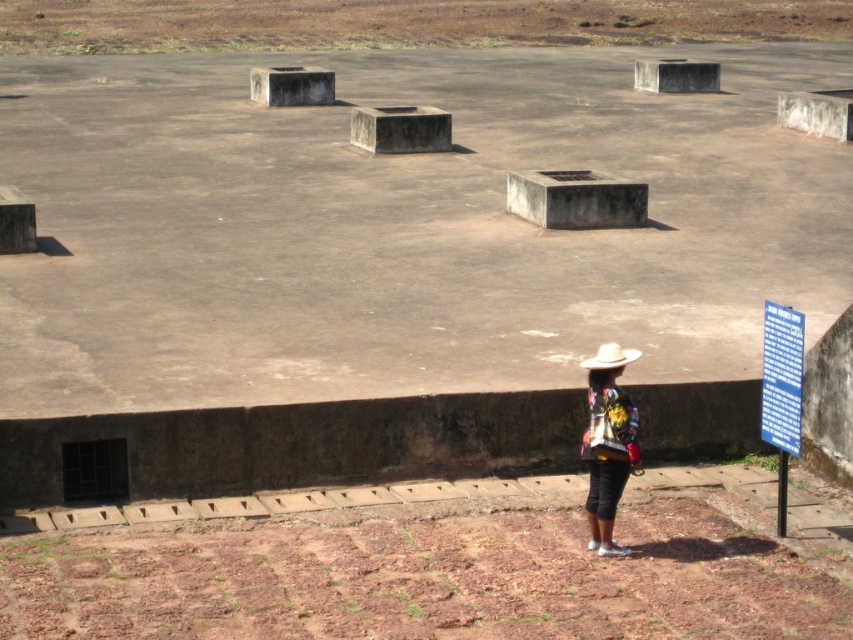
Does floral fabric jacket at lower right have a smaller size compared to white matte cowboy hat at lower right?

Yes.

Is floral fabric jacket at lower right below white matte cowboy hat at lower right?

Correct, floral fabric jacket at lower right is located below white matte cowboy hat at lower right.

Describe the element at coordinates (607, 444) in the screenshot. I see `floral fabric jacket at lower right` at that location.

Locate an element on the screen. The height and width of the screenshot is (640, 853). floral fabric jacket at lower right is located at coordinates (607, 444).

Is brown dirt field at upper center further to the viewer compared to floral fabric jacket at lower right?

Yes, it is.

Identify the location of brown dirt field at upper center. (403, 22).

Is brown dirt field at upper center shorter than white matte cowboy hat at lower right?

In fact, brown dirt field at upper center may be taller than white matte cowboy hat at lower right.

Who is taller, brown dirt field at upper center or white matte cowboy hat at lower right?

With more height is brown dirt field at upper center.

Does point (796, 38) come in front of point (589, 364)?

No, (796, 38) is behind (589, 364).

Find the location of a particular element. This screenshot has height=640, width=853. brown dirt field at upper center is located at coordinates (403, 22).